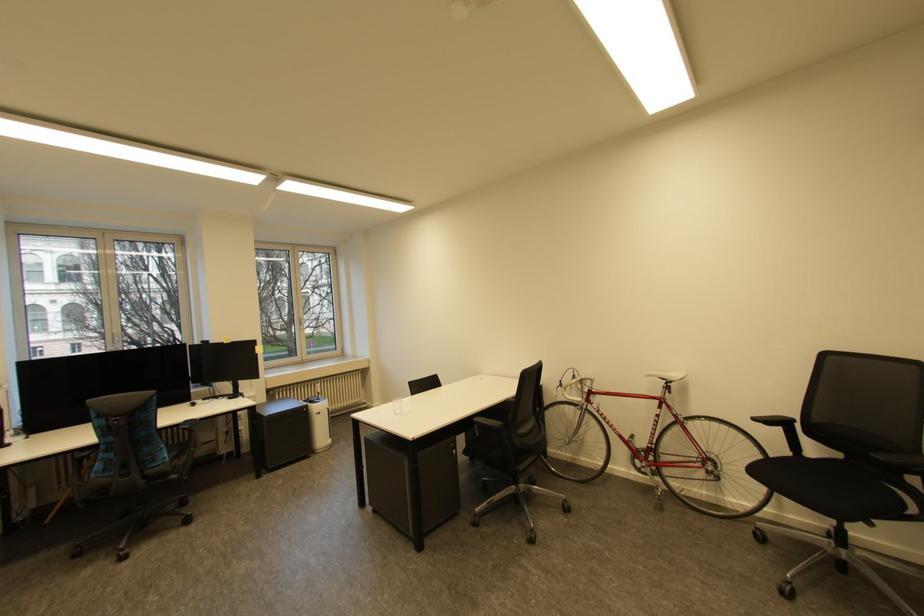
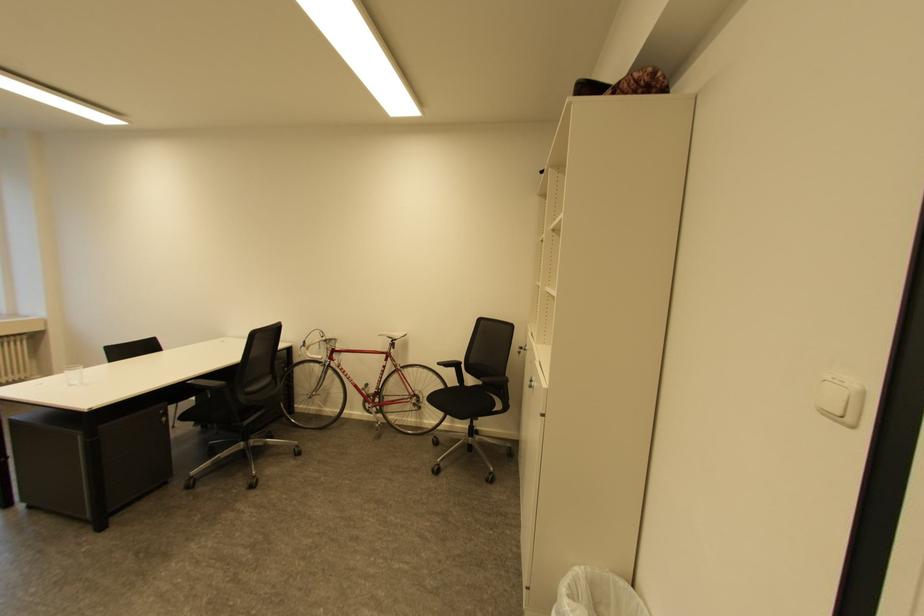
Where in the second image is the point corresponding to (786,430) from the first image?

(459, 370)